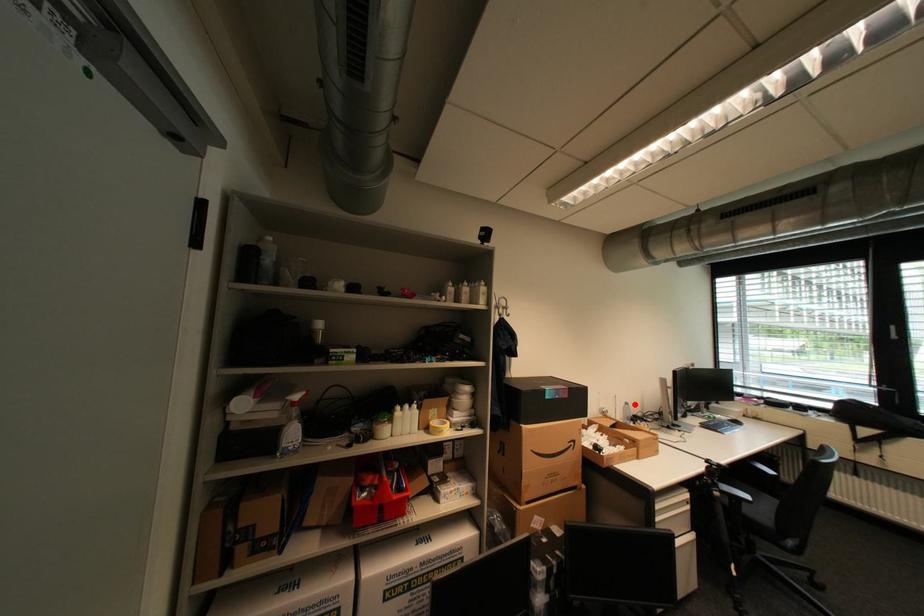
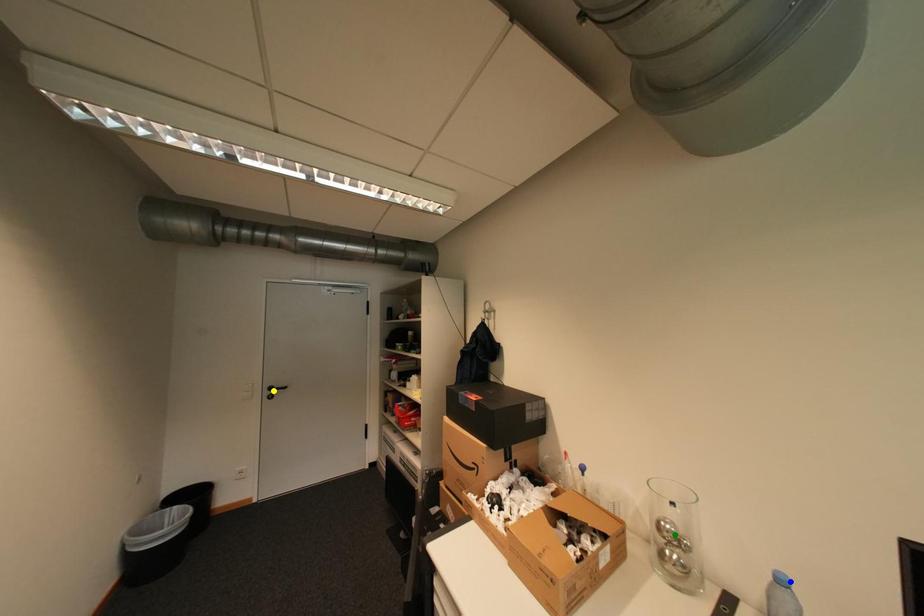
Question: I am providing you with two images of the same scene from different viewpoints. A red point is marked on the first image. You are given multiple points on the second image. Which point in image 2 is actually the same real-world point as the red point in image 1?

Choices:
 (A) yellow point
 (B) green point
 (C) blue point

Answer: (C)